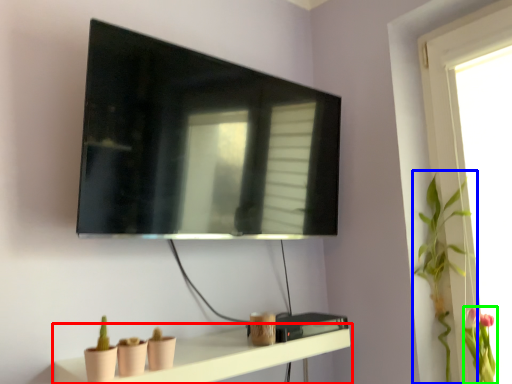
Question: Which object is the farthest from shelf (highlighted by a red box)? Choose among these: plant (highlighted by a blue box) or floral arrangement (highlighted by a green box).

Choices:
 (A) plant
 (B) floral arrangement

Answer: (B)